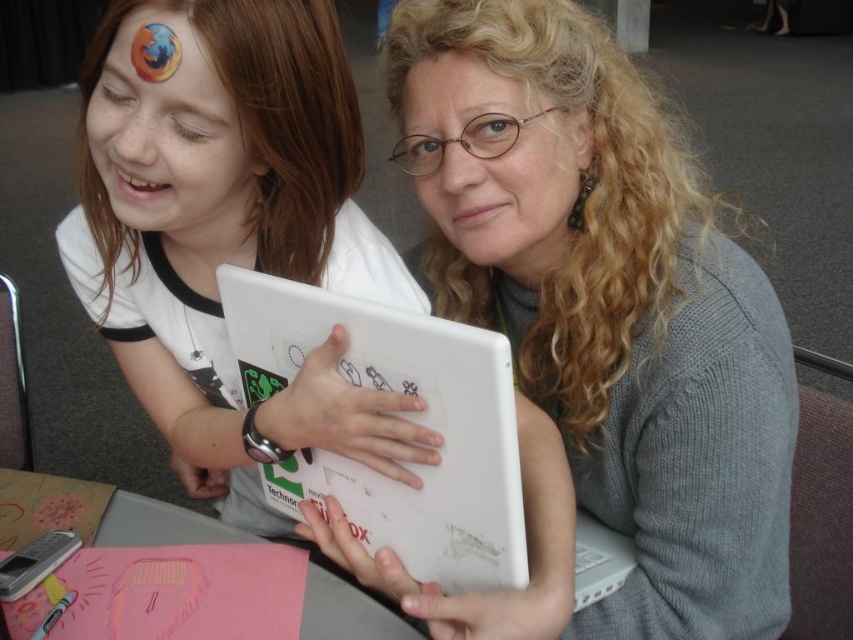
You are a delivery person who needs to place a small package between the white matte tablet at center and the camera. The package is 12 inches long. Can you fit it in the space between them without tilting it?

The space between the white matte tablet at center and the camera is 25.29 inches. Since the package is only 12 inches long, it can easily fit in the space between them without tilting.